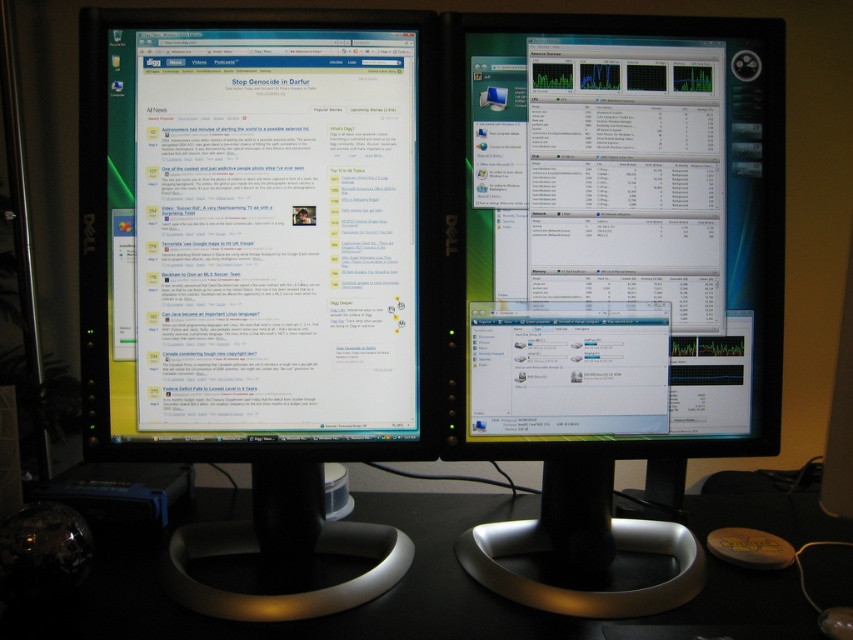
Describe the element at coordinates (613, 236) in the screenshot. I see `matte black monitor at right` at that location.

You are a GUI agent. You are given a task and a screenshot of the screen. Output one action in this format:
    pyautogui.click(x=<x>, y=<y>)
    Task: Click on the matte black monitor at right
    
    Given the screenshot: What is the action you would take?
    pyautogui.click(x=613, y=236)

Is point (541, 292) farther from camera compared to point (433, 540)?

No, (541, 292) is in front of (433, 540).

You are a GUI agent. You are given a task and a screenshot of the screen. Output one action in this format:
    pyautogui.click(x=<x>, y=<y>)
    Task: Click on the matte black monitor at right
    Image resolution: width=853 pixels, height=640 pixels.
    Given the screenshot: What is the action you would take?
    pyautogui.click(x=613, y=236)

Does black glossy monitor at left have a greater height compared to black plastic computer desk at center?

Correct, black glossy monitor at left is much taller as black plastic computer desk at center.

Identify the location of black glossy monitor at left. (260, 269).

Looking at this image, does black glossy monitor at left appear under matte black monitor at right?

Correct, black glossy monitor at left is located below matte black monitor at right.

Does point (102, 36) lie behind point (531, 388)?

That is False.

Is point (361, 349) in front of point (776, 76)?

That is True.

Image resolution: width=853 pixels, height=640 pixels. In order to click on black glossy monitor at left in this screenshot , I will do `click(260, 269)`.